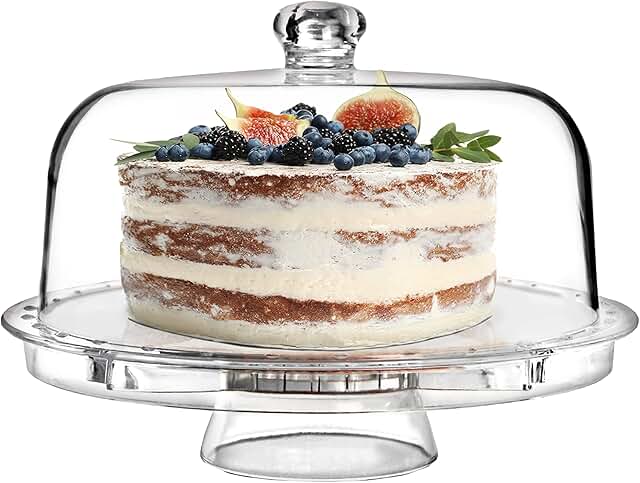
Image resolution: width=640 pixels, height=483 pixels. Identify the location of clear cake board lid. (246, 82).